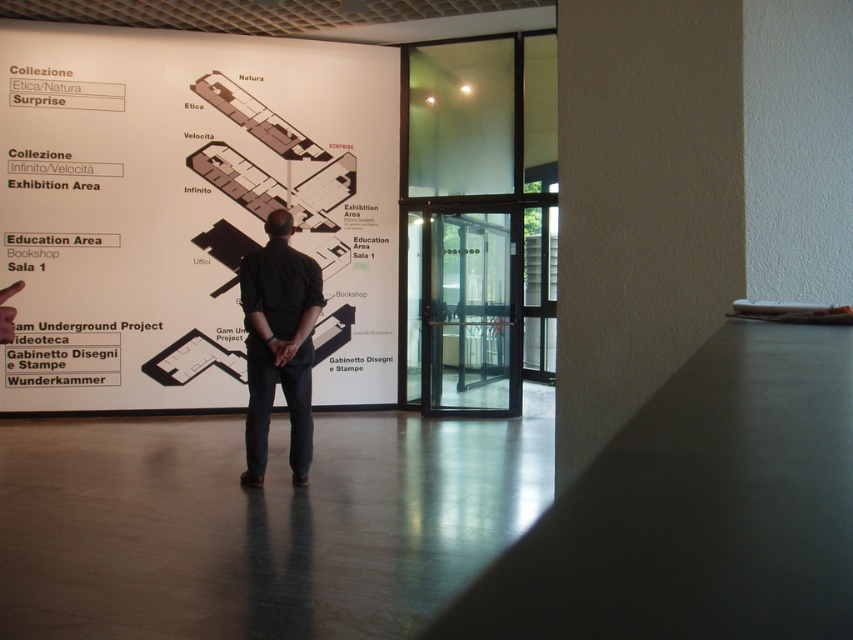
Is white paper at upper left above black cotton shirt at center?

Indeed, white paper at upper left is positioned over black cotton shirt at center.

Does white paper at upper left lie in front of black cotton shirt at center?

No, white paper at upper left is further to the viewer.

Who is more forward, (339, 291) or (258, 336)?

Positioned in front is point (258, 336).

This screenshot has width=853, height=640. What are the coordinates of `white paper at upper left` in the screenshot? It's located at click(x=189, y=211).